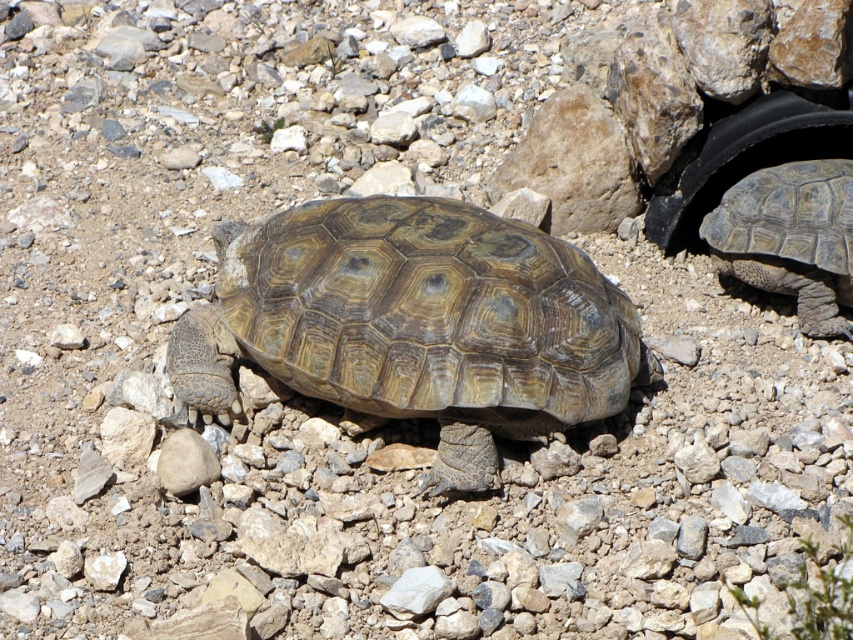
Is point (793, 182) behind point (680, 212)?

That is False.

Is leathery brown tortoise at right smaller than black rubber tire at upper right?

Yes.

The width and height of the screenshot is (853, 640). Find the location of `leathery brown tortoise at right`. leathery brown tortoise at right is located at coordinates [x=790, y=237].

Locate an element on the screen. Image resolution: width=853 pixels, height=640 pixels. leathery brown tortoise at right is located at coordinates (790, 237).

Does brown textured shell at center come behind black rubber tire at upper right?

That is False.

Which is more to the left, brown textured shell at center or black rubber tire at upper right?

Positioned to the left is brown textured shell at center.

Is point (428, 394) positioned before point (805, 113)?

That is True.

I want to click on brown textured shell at center, so click(416, 324).

Does brown textured shell at center appear on the right side of leathery brown tortoise at right?

In fact, brown textured shell at center is to the left of leathery brown tortoise at right.

Does brown textured shell at center appear on the left side of leathery brown tortoise at right?

Correct, you'll find brown textured shell at center to the left of leathery brown tortoise at right.

This screenshot has height=640, width=853. What do you see at coordinates (416, 324) in the screenshot? I see `brown textured shell at center` at bounding box center [416, 324].

Locate an element on the screen. The image size is (853, 640). brown textured shell at center is located at coordinates (416, 324).